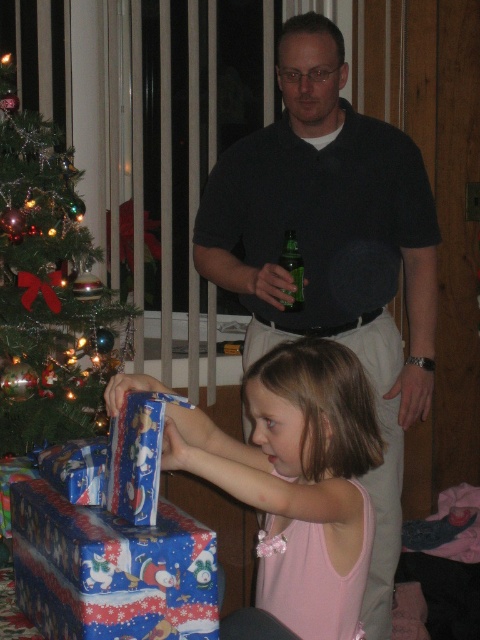
Question: Does dark gray shirt at center come in front of shiny green tree at left?

Choices:
 (A) no
 (B) yes

Answer: (A)

Question: Which object is positioned farthest from the green glass bottle at center?

Choices:
 (A) shiny green tree at left
 (B) dark gray shirt at center
 (C) blue shiny wrapping paper at lower left

Answer: (C)

Question: Is dark gray shirt at center below green glass bottle at center?

Choices:
 (A) no
 (B) yes

Answer: (B)

Question: Which point is closer to the camera?

Choices:
 (A) green glass bottle at center
 (B) shiny green tree at left
 (C) dark gray shirt at center
 (D) matte blue wrapping paper at lower center

Answer: (D)

Question: Which point appears closest to the camera in this image?

Choices:
 (A) (300, 596)
 (B) (286, 243)

Answer: (A)

Question: Can you confirm if shiny green tree at left is bigger than blue shiny wrapping paper at lower left?

Choices:
 (A) yes
 (B) no

Answer: (A)